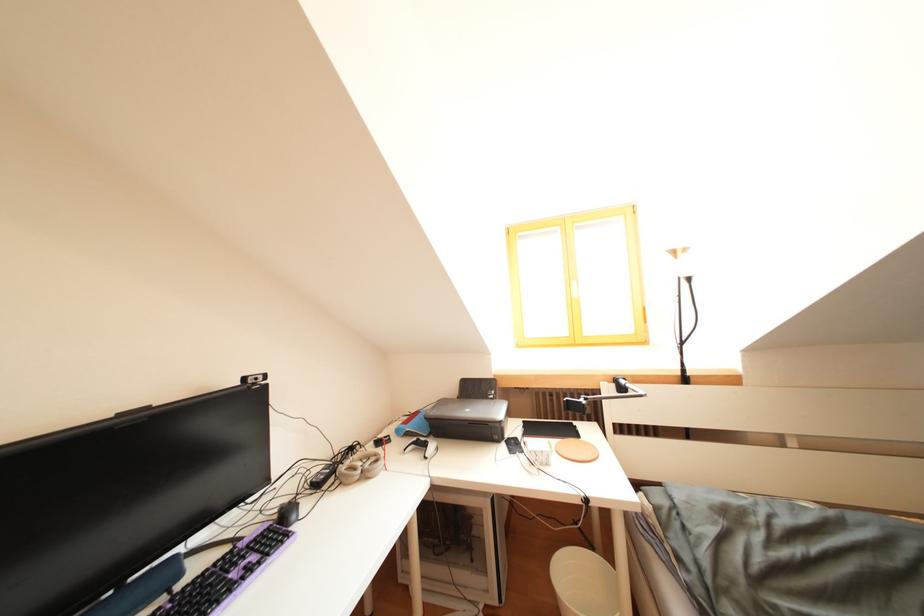
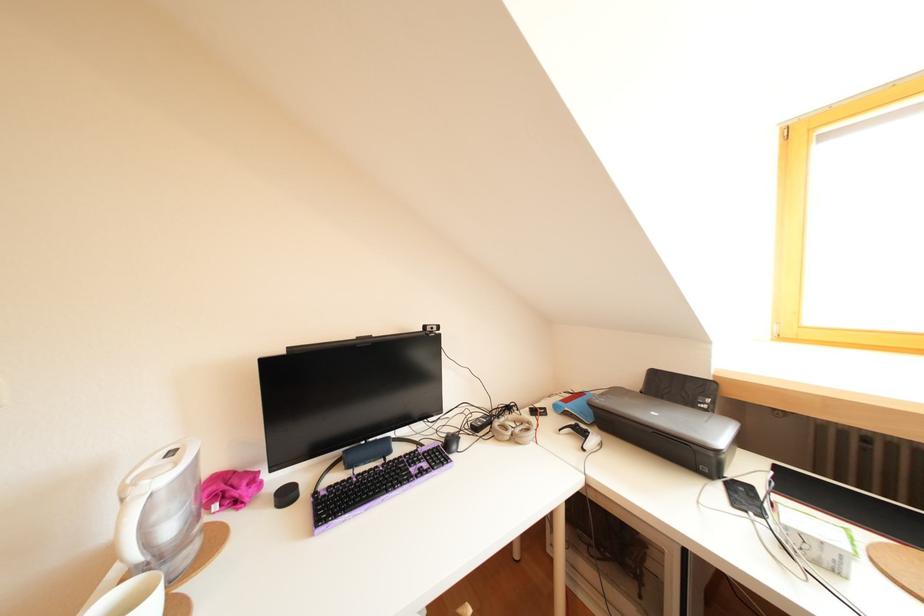
Where in the second image is the point corresponding to (284,522) from the first image?

(453, 445)